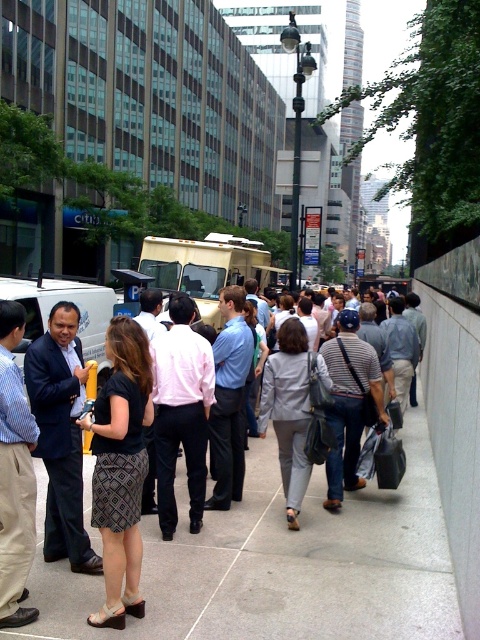
You are a delivery person trying to navigate through the crowd on the sidewalk. You see a pink shirt at center and a beige plastic food truck at center. Which one is easier to walk around?

The pink shirt at center has a smaller size compared to the beige plastic food truck at center, so it is easier to walk around the pink shirt at center.

Based on the photo, you are a pedestrian trying to cross the sidewalk between the gray fabric jacket at center and the beige plastic food truck at center. Considering their widths, which one do you think you can pass by more easily?

The gray fabric jacket at center has a lesser width compared to the beige plastic food truck at center, so you can pass by the gray fabric jacket at center more easily.